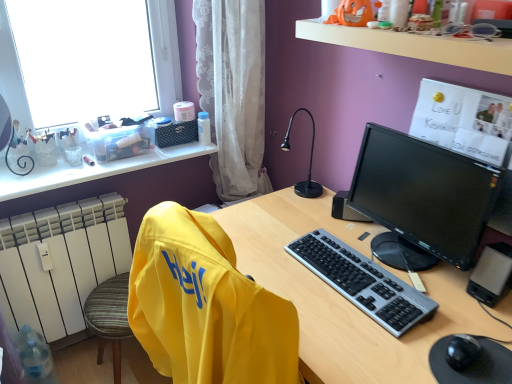
I want to click on free space in front of black plastic computer tower at lower right, so tap(492, 325).